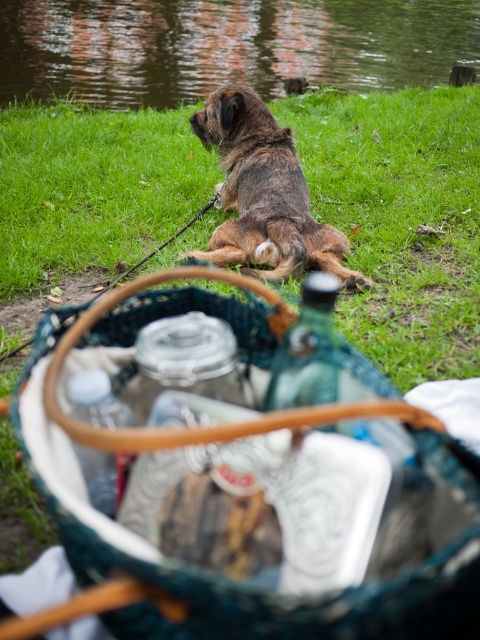
You are a hiker who needs to get to the water to refill your bottle. You see the green water at upper center and the brown shaggy dog at center. Which direction should you go from the dog to reach the water?

The green water at upper center is positioned on the left side of the brown shaggy dog at center, so you should go to the left of the brown shaggy dog at center to reach the water.

You are a hiker who wants to give water to the brown shaggy dog at center. The green water at upper center is a lake. Can you directly pour water from the lake into the dog bowl without moving the dog?

The brown shaggy dog at center is behind the green water at upper center, so you can directly pour water from the lake into the dog bowl without needing to move the dog.

You are planning to take a photo of the brown shaggy dog at center and the green water at upper center. Which object should you focus on first if you want to capture both in a single frame without moving the camera?

The green water at upper center is larger in size than the brown shaggy dog at center, so you should focus on the green water at upper center first to ensure it fills the frame appropriately before adjusting for the smaller dog.